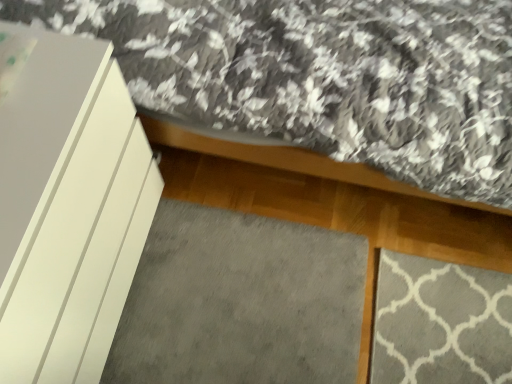
The height and width of the screenshot is (384, 512). What do you see at coordinates (240, 302) in the screenshot?
I see `gray soft carpet at lower center` at bounding box center [240, 302].

In order to click on gray soft carpet at lower center in this screenshot , I will do `click(240, 302)`.

From the picture: What is the approximate height of white matte cabinet at left?

white matte cabinet at left is 30.59 inches tall.

Describe the element at coordinates (66, 204) in the screenshot. I see `white matte cabinet at left` at that location.

At what (x,y) coordinates should I click in order to perform the action: click on white matte cabinet at left. Please return your answer as a coordinate pair (x, y). The image size is (512, 384). Looking at the image, I should click on (66, 204).

You are a GUI agent. You are given a task and a screenshot of the screen. Output one action in this format:
    pyautogui.click(x=<x>, y=<y>)
    Task: Click on the gray soft carpet at lower center
    
    Given the screenshot: What is the action you would take?
    240,302

Can you confirm if gray soft carpet at lower center is positioned to the left of white matte cabinet at left?

In fact, gray soft carpet at lower center is to the right of white matte cabinet at left.

Considering the relative positions of gray soft carpet at lower center and white matte cabinet at left in the image provided, is gray soft carpet at lower center in front of white matte cabinet at left?

No, gray soft carpet at lower center is further to the viewer.

Does point (310, 251) come in front of point (28, 98)?

That is False.

From the image's perspective, between gray soft carpet at lower center and white matte cabinet at left, which one is located above?

white matte cabinet at left appears higher in the image.

From a real-world perspective, who is located higher, gray soft carpet at lower center or white matte cabinet at left?

white matte cabinet at left, from a real-world perspective.

Which object is wider, gray soft carpet at lower center or white matte cabinet at left?

gray soft carpet at lower center is wider.

Consider the image. Between gray soft carpet at lower center and white matte cabinet at left, which one has less height?

gray soft carpet at lower center is shorter.

Considering the relative sizes of gray soft carpet at lower center and white matte cabinet at left in the image provided, is gray soft carpet at lower center smaller than white matte cabinet at left?

Yes.

Is gray soft carpet at lower center inside the boundaries of white matte cabinet at left, or outside?

gray soft carpet at lower center is spatially situated outside white matte cabinet at left.

Does gray soft carpet at lower center touch white matte cabinet at left?

They are not placed beside each other.

Is gray soft carpet at lower center oriented away from white matte cabinet at left?

No, white matte cabinet at left is not at the back of gray soft carpet at lower center.

How different are the orientations of gray soft carpet at lower center and white matte cabinet at left in degrees?

They differ by 0.609 degrees in their facing directions.

You are a GUI agent. You are given a task and a screenshot of the screen. Output one action in this format:
    pyautogui.click(x=<x>, y=<y>)
    Task: Click on the mat below the white matte cabinet at left (from a real-world perspective)
    
    Given the screenshot: What is the action you would take?
    pyautogui.click(x=240, y=302)

Is white matte cabinet at left at the left side of gray soft carpet at lower center?

Yes, white matte cabinet at left is to the left of gray soft carpet at lower center.

Is white matte cabinet at left further to camera compared to gray soft carpet at lower center?

No, the depth of white matte cabinet at left is less than that of gray soft carpet at lower center.

Between point (63, 320) and point (168, 262), which one is positioned behind?

Positioned behind is point (168, 262).

From the image's perspective, which is above, white matte cabinet at left or gray soft carpet at lower center?

white matte cabinet at left appears higher in the image.

From a real-world perspective, is white matte cabinet at left positioned under gray soft carpet at lower center based on gravity?

No, from a real-world perspective, white matte cabinet at left is not under gray soft carpet at lower center.

Can you confirm if white matte cabinet at left is thinner than gray soft carpet at lower center?

Correct, the width of white matte cabinet at left is less than that of gray soft carpet at lower center.

Which of these two, white matte cabinet at left or gray soft carpet at lower center, stands taller?

white matte cabinet at left.

Is white matte cabinet at left smaller than gray soft carpet at lower center?

No.

Is white matte cabinet at left positioned beyond the bounds of gray soft carpet at lower center?

Yes, white matte cabinet at left is not within gray soft carpet at lower center.

Are white matte cabinet at left and gray soft carpet at lower center far apart?

white matte cabinet at left is near gray soft carpet at lower center, not far away.

Is gray soft carpet at lower center at the back of white matte cabinet at left?

No, white matte cabinet at left's orientation is not away from gray soft carpet at lower center.

What's the angular difference between white matte cabinet at left and gray soft carpet at lower center's facing directions?

0.609 degrees separate the facing orientations of white matte cabinet at left and gray soft carpet at lower center.

The image size is (512, 384). Identify the location of mat below the white matte cabinet at left (from the image's perspective). (240, 302).

This screenshot has width=512, height=384. I want to click on furniture on the left of gray soft carpet at lower center, so click(66, 204).

Where is `mat located below the white matte cabinet at left (from the image's perspective)`? mat located below the white matte cabinet at left (from the image's perspective) is located at coordinates (240, 302).